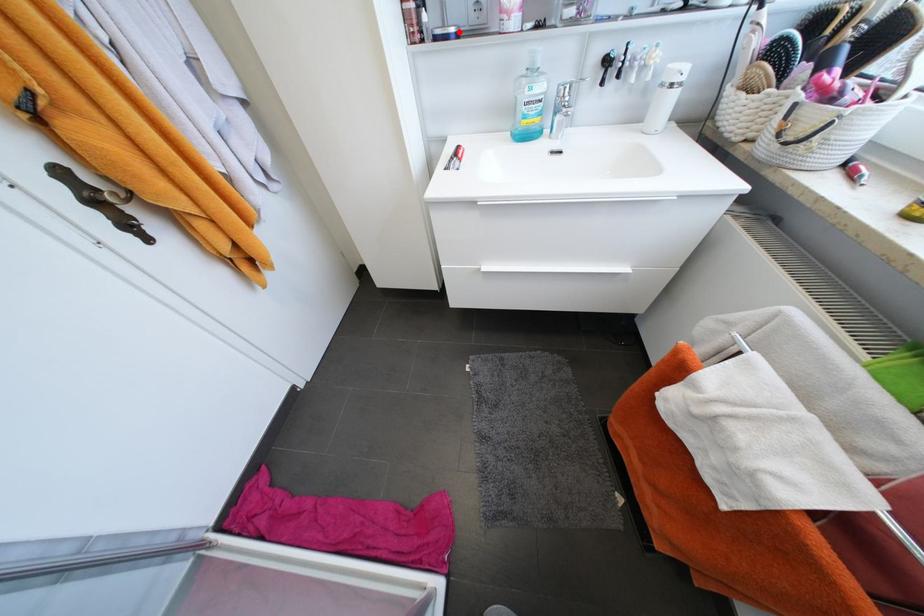
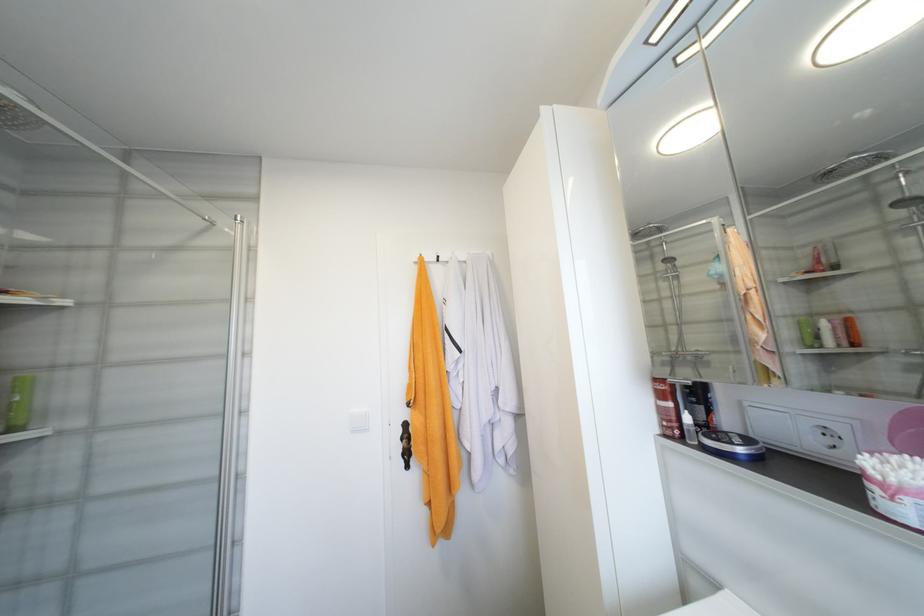
Find the pixel in the second image that matches the highlighted location in the first image.

(747, 451)